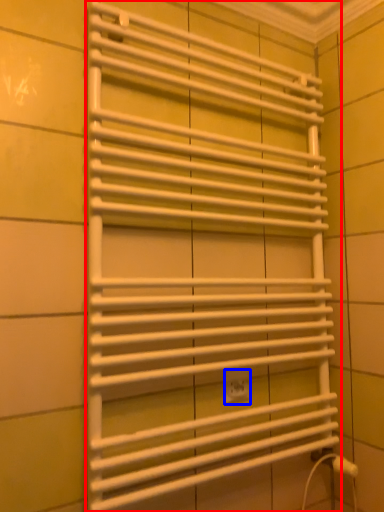
Question: Among these objects, which one is nearest to the camera, towel rack (highlighted by a red box) or electric outlet (highlighted by a blue box)?

Choices:
 (A) towel rack
 (B) electric outlet

Answer: (A)